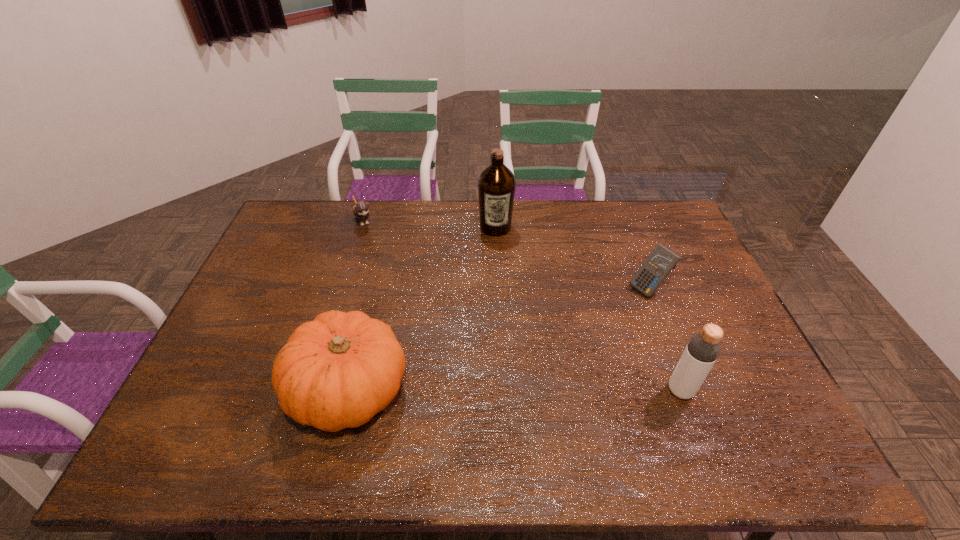
Where is `pumpkin`? This screenshot has height=540, width=960. pumpkin is located at coordinates (337, 371).

Identify the location of the second tallest object. The height and width of the screenshot is (540, 960). (703, 349).

Identify the location of the third farthest object. Image resolution: width=960 pixels, height=540 pixels. point(661,261).

This screenshot has height=540, width=960. I want to click on the fourth tallest object, so click(661, 261).

What are the coordinates of `the third object from left to right` in the screenshot? It's located at (496, 185).

I want to click on olive oil, so click(496, 185).

Find the location of a particular element. The height and width of the screenshot is (540, 960). kitten is located at coordinates (360, 209).

Find the location of a particular element. This screenshot has height=540, width=960. blank space located 0.250m on the left of the third tallest object is located at coordinates (191, 390).

Locate an element on the screen. The height and width of the screenshot is (540, 960). vacant space situated on the back of the fourth shortest object is located at coordinates (x=653, y=317).

Locate an element on the screen. This screenshot has width=960, height=540. vacant space situated 0.060m on the front-facing side of the calculator is located at coordinates (623, 305).